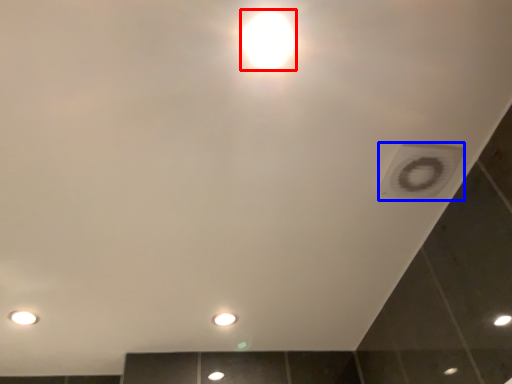
Question: Which object is further to the camera taking this photo, light bulb (highlighted by a red box) or hole (highlighted by a blue box)?

Choices:
 (A) light bulb
 (B) hole

Answer: (B)